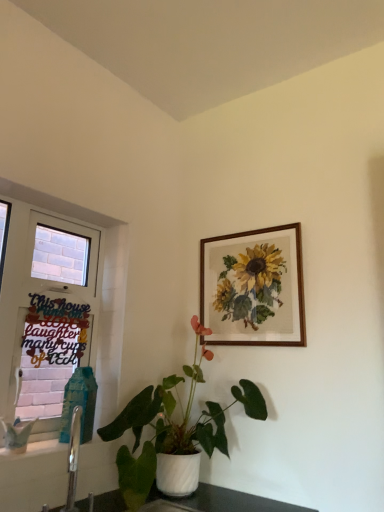
Question: Would you say black paper sign at left is to the left or to the right of white painted wood window at left in the picture?

Choices:
 (A) left
 (B) right

Answer: (B)

Question: Relative to white painted wood window at left, is black paper sign at left in front or behind?

Choices:
 (A) behind
 (B) front

Answer: (A)

Question: Which is nearer to the white glossy pot at center?

Choices:
 (A) wooden frame at upper right
 (B) black paper sign at left
 (C) white painted wood window at left

Answer: (A)

Question: Which of these objects is positioned farthest from the white glossy pot at center?

Choices:
 (A) wooden frame at upper right
 (B) black paper sign at left
 (C) white painted wood window at left

Answer: (B)